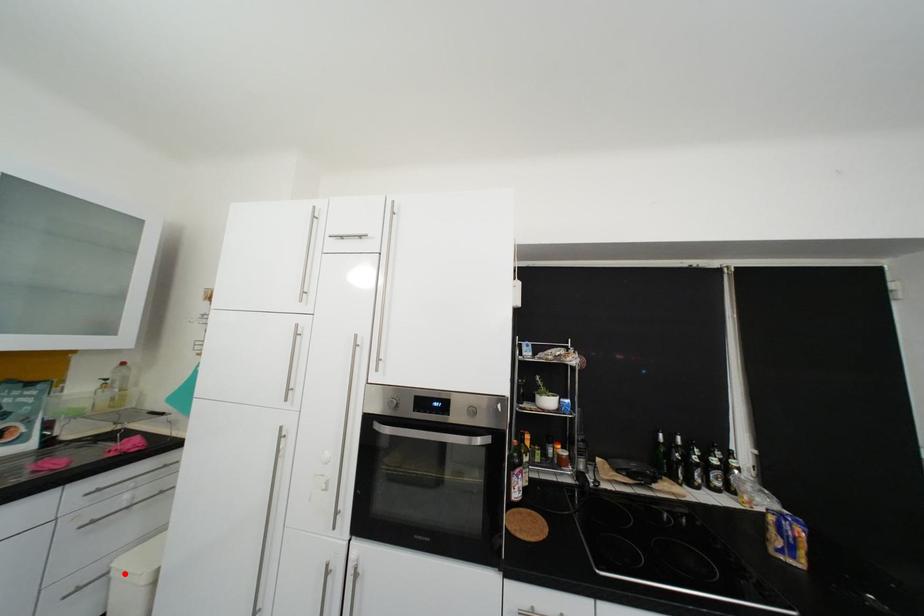
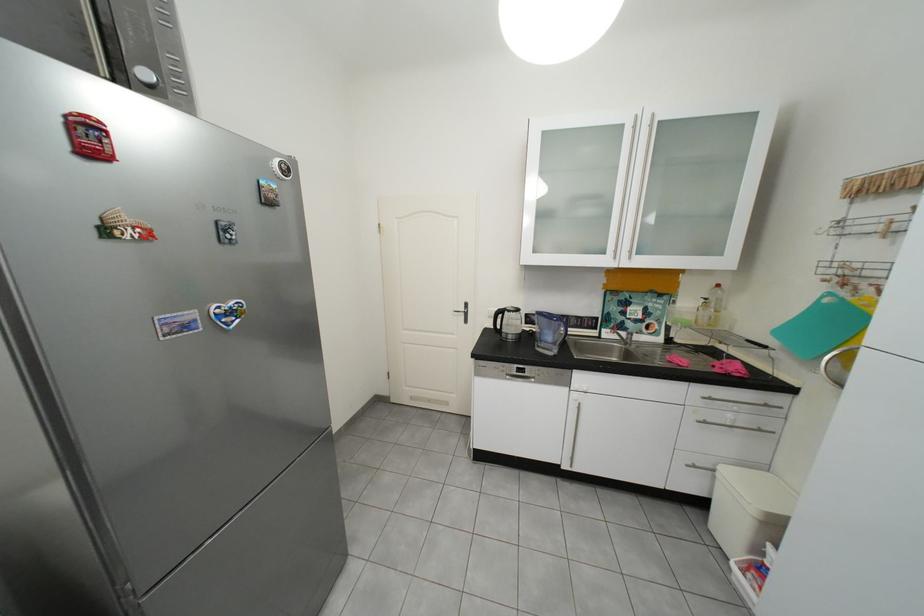
Question: I am providing you with two images of the same scene from different viewpoints. A red point is shown in image1. For the corresponding object point in image2, is it positioned nearer or farther from the camera?

Choices:
 (A) Nearer
 (B) Farther

Answer: (B)